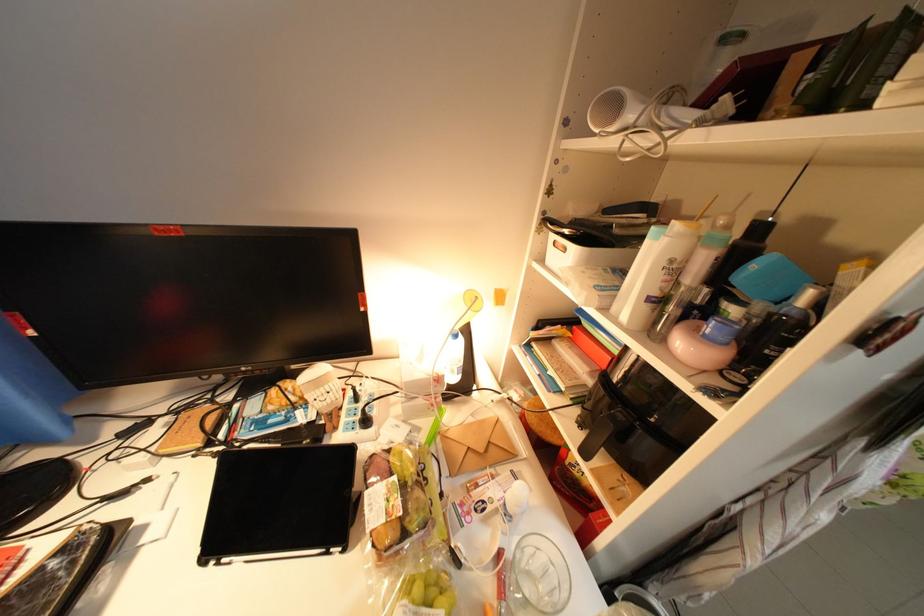
Image resolution: width=924 pixels, height=616 pixels. What are the coordinates of `water bottle cap` in the screenshot? It's located at (732, 306).